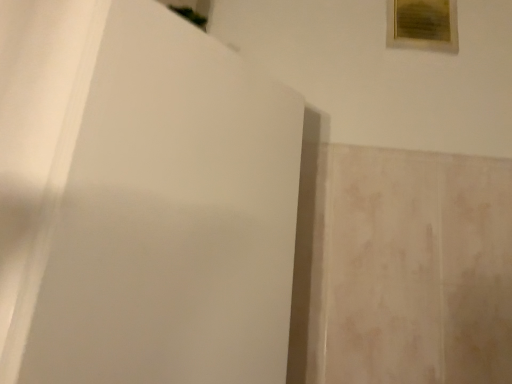
Question: Considering the relative sizes of white matte screen door at center and wooden frame at upper right in the image provided, is white matte screen door at center thinner than wooden frame at upper right?

Choices:
 (A) yes
 (B) no

Answer: (B)

Question: Is white matte screen door at center further to the viewer compared to wooden frame at upper right?

Choices:
 (A) no
 (B) yes

Answer: (A)

Question: Can you confirm if white matte screen door at center is bigger than wooden frame at upper right?

Choices:
 (A) yes
 (B) no

Answer: (A)

Question: Is white matte screen door at center in contact with wooden frame at upper right?

Choices:
 (A) yes
 (B) no

Answer: (B)

Question: Can you confirm if white matte screen door at center is wider than wooden frame at upper right?

Choices:
 (A) yes
 (B) no

Answer: (A)

Question: Is white matte screen door at center facing towards wooden frame at upper right?

Choices:
 (A) yes
 (B) no

Answer: (B)

Question: Does wooden frame at upper right turn towards white matte screen door at center?

Choices:
 (A) yes
 (B) no

Answer: (B)

Question: From a real-world perspective, is wooden frame at upper right below white matte screen door at center?

Choices:
 (A) no
 (B) yes

Answer: (A)

Question: From a real-world perspective, is wooden frame at upper right physically above white matte screen door at center?

Choices:
 (A) no
 (B) yes

Answer: (B)

Question: Is wooden frame at upper right taller than white matte screen door at center?

Choices:
 (A) no
 (B) yes

Answer: (A)

Question: Is wooden frame at upper right to the left of white matte screen door at center from the viewer's perspective?

Choices:
 (A) no
 (B) yes

Answer: (A)

Question: Is wooden frame at upper right further to camera compared to white matte screen door at center?

Choices:
 (A) yes
 (B) no

Answer: (A)

Question: From a real-world perspective, is white matte screen door at center positioned above or below wooden frame at upper right?

Choices:
 (A) above
 (B) below

Answer: (B)